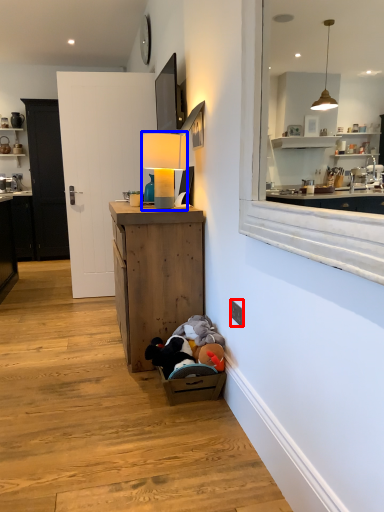
Question: Which object is further to the camera taking this photo, electric outlet (highlighted by a red box) or table lamp (highlighted by a blue box)?

Choices:
 (A) electric outlet
 (B) table lamp

Answer: (B)